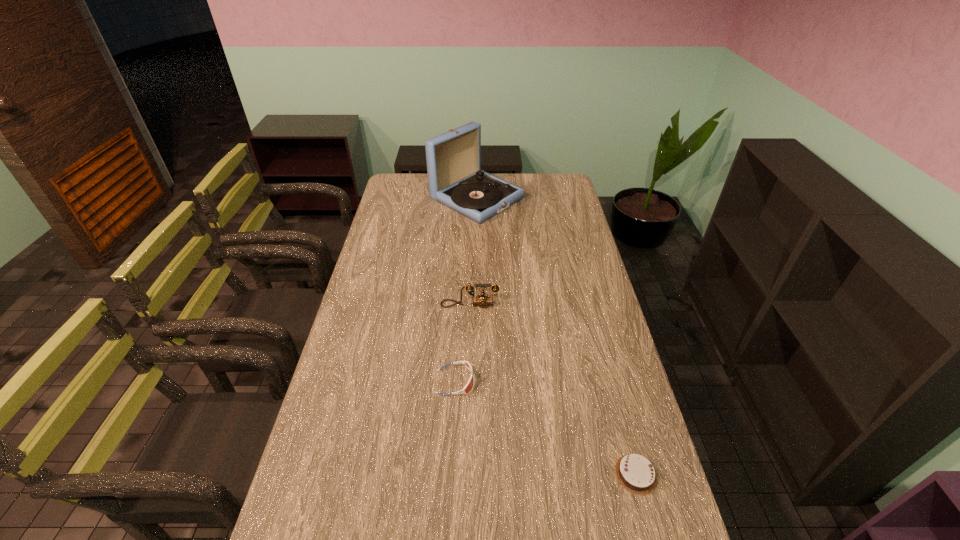
Image resolution: width=960 pixels, height=540 pixels. Identify the location of the tallest object. (455, 179).

The height and width of the screenshot is (540, 960). Identify the location of the farthest object. pyautogui.click(x=455, y=179).

Find the location of a particular element. The height and width of the screenshot is (540, 960). the second farthest object is located at coordinates (482, 300).

Locate an element on the screen. telephone is located at coordinates (482, 300).

Where is `the third tallest object`? The image size is (960, 540). the third tallest object is located at coordinates (469, 385).

Image resolution: width=960 pixels, height=540 pixels. What are the coordinates of `the third farthest object` in the screenshot? It's located at (469, 385).

This screenshot has height=540, width=960. Find the location of `the rightmost object`. the rightmost object is located at coordinates (635, 473).

Find the location of a particular element. chocolate cake is located at coordinates (635, 473).

I want to click on vacant space located 0.110m on the right of the tallest object, so click(546, 198).

I want to click on vacant space located 0.340m on the front-facing side of the telephone, so click(468, 392).